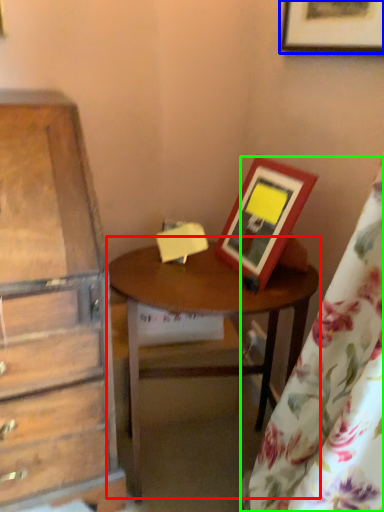
Question: Which object is the closest to the table (highlighted by a red box)? Choose among these: picture frame (highlighted by a blue box) or curtain (highlighted by a green box).

Choices:
 (A) picture frame
 (B) curtain

Answer: (B)